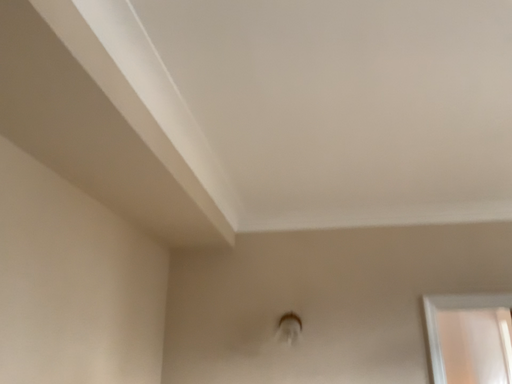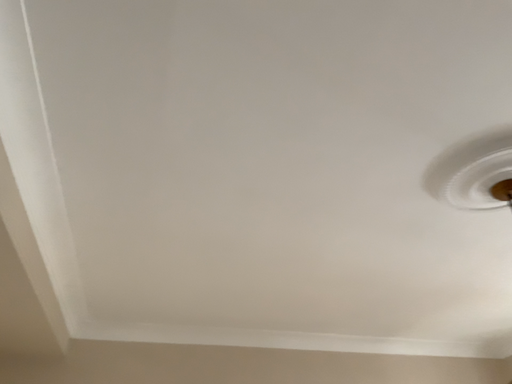
Question: Which way did the camera rotate in the video?

Choices:
 (A) rotated upward
 (B) rotated downward

Answer: (A)